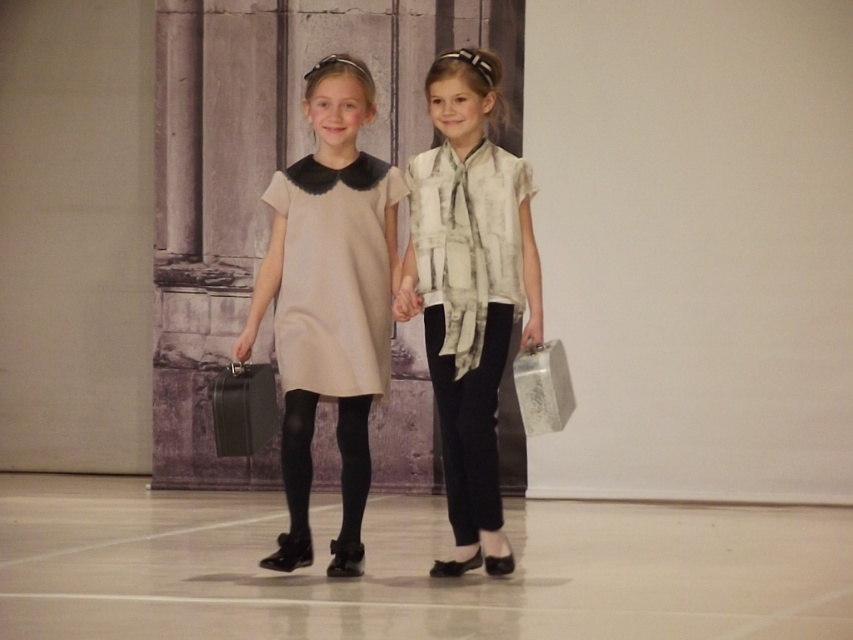
You are a photographer setting up for a group photo. You notice two items in the scene that might affect the composition. The white printed blouse at center and the black smooth pants at center. Which item should you adjust if you want to ensure the outfit looks balanced in width?

The white printed blouse at center might be wider than black smooth pants at center, so adjusting the white printed blouse at center could help balance the width between the two items.

You are a photographer setting up for a group photo. You notice the beige matte dress at center and the metallic briefcase at center. Which object is wider?

The beige matte dress at center is wider than the metallic briefcase at center according to the description.

You are a photographer setting up for a group photo. You notice the black smooth pants at center and the metallic briefcase at center in the scene. Which object is closer to you?

The black smooth pants at center is closer to you than the metallic briefcase at center.